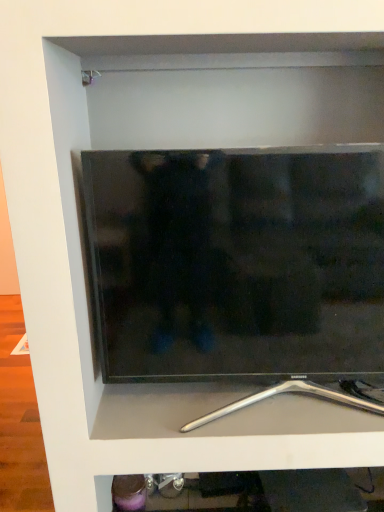
Question: Looking at the image, does metallic silver stand at bottom seem bigger or smaller compared to black glossy tv at center?

Choices:
 (A) small
 (B) big

Answer: (A)

Question: From the image's perspective, is metallic silver stand at bottom above or below black glossy tv at center?

Choices:
 (A) above
 (B) below

Answer: (B)

Question: Looking at their shapes, would you say metallic silver stand at bottom is wider or thinner than black glossy tv at center?

Choices:
 (A) wide
 (B) thin

Answer: (A)

Question: Would you say black glossy tv at center is to the left or to the right of metallic silver stand at bottom in the picture?

Choices:
 (A) right
 (B) left

Answer: (B)

Question: Considering their positions, is black glossy tv at center located in front of or behind metallic silver stand at bottom?

Choices:
 (A) behind
 (B) front

Answer: (B)

Question: Considering the positions of black glossy tv at center and metallic silver stand at bottom in the image, is black glossy tv at center taller or shorter than metallic silver stand at bottom?

Choices:
 (A) tall
 (B) short

Answer: (A)

Question: Choose the correct answer: Is black glossy tv at center inside metallic silver stand at bottom or outside it?

Choices:
 (A) inside
 (B) outside

Answer: (B)